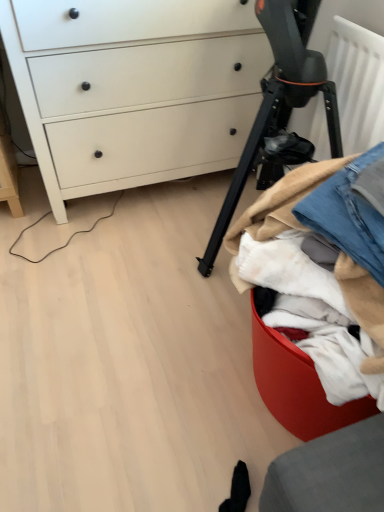
The image size is (384, 512). What are the coordinates of `vacant space situated on the left part of black matte tripod at center` in the screenshot? It's located at (122, 266).